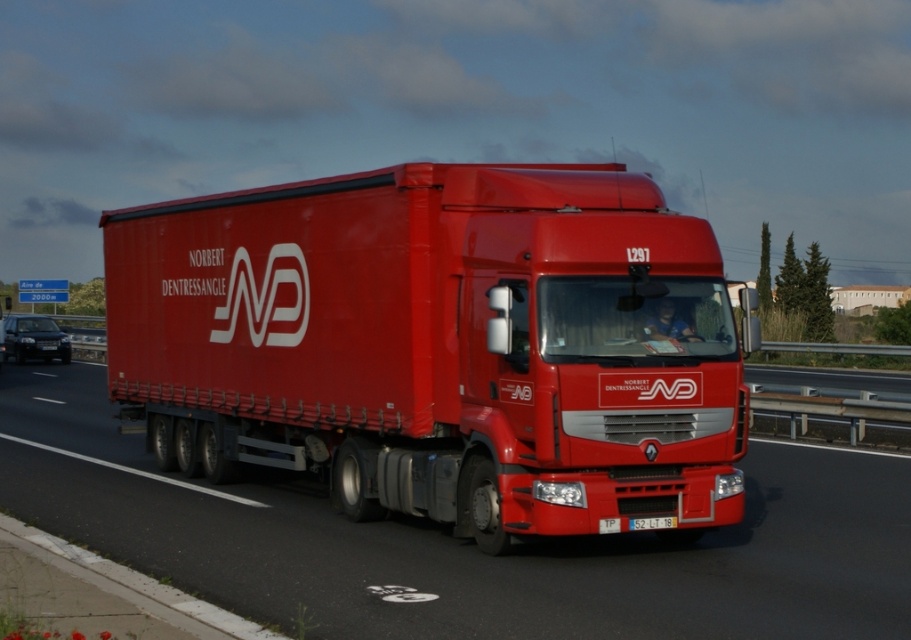
Question: Which object appears closest to the camera in this image?

Choices:
 (A) matte red trailer truck at center
 (B) matte red truck at center
 (C) white plastic license plate at center

Answer: (B)

Question: Among these points, which one is farthest from the camera?

Choices:
 (A) (237, 257)
 (B) (642, 522)
 (C) (760, 493)

Answer: (A)

Question: Estimate the real-world distances between objects in this image. Which object is closer to the white plastic license plate at center?

Choices:
 (A) matte red truck at center
 (B) matte red trailer truck at center

Answer: (A)

Question: Does matte red trailer truck at center have a lesser width compared to white plastic license plate at center?

Choices:
 (A) yes
 (B) no

Answer: (B)

Question: Can you confirm if matte red trailer truck at center is bigger than white plastic license plate at center?

Choices:
 (A) yes
 (B) no

Answer: (A)

Question: Does matte red trailer truck at center have a larger size compared to white plastic license plate at center?

Choices:
 (A) yes
 (B) no

Answer: (A)